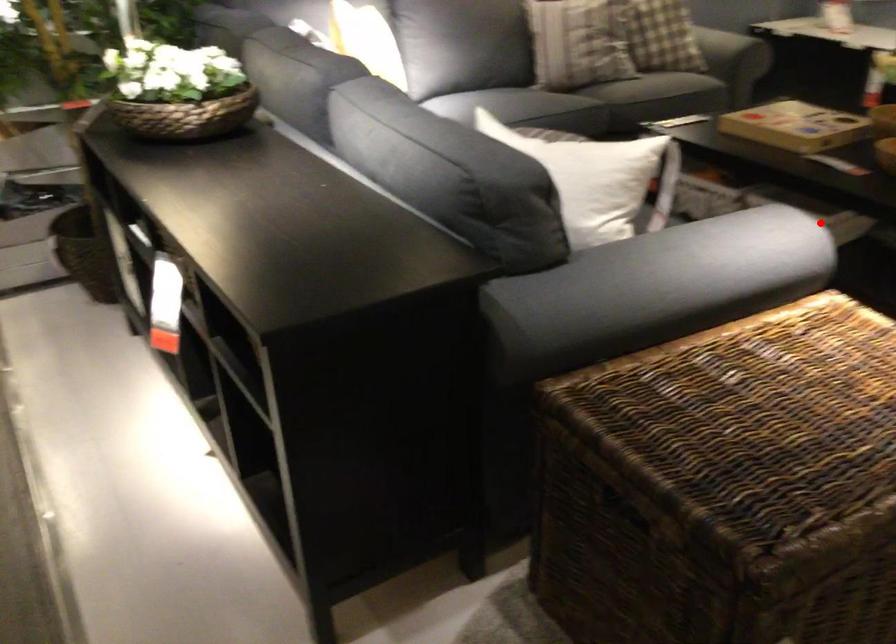
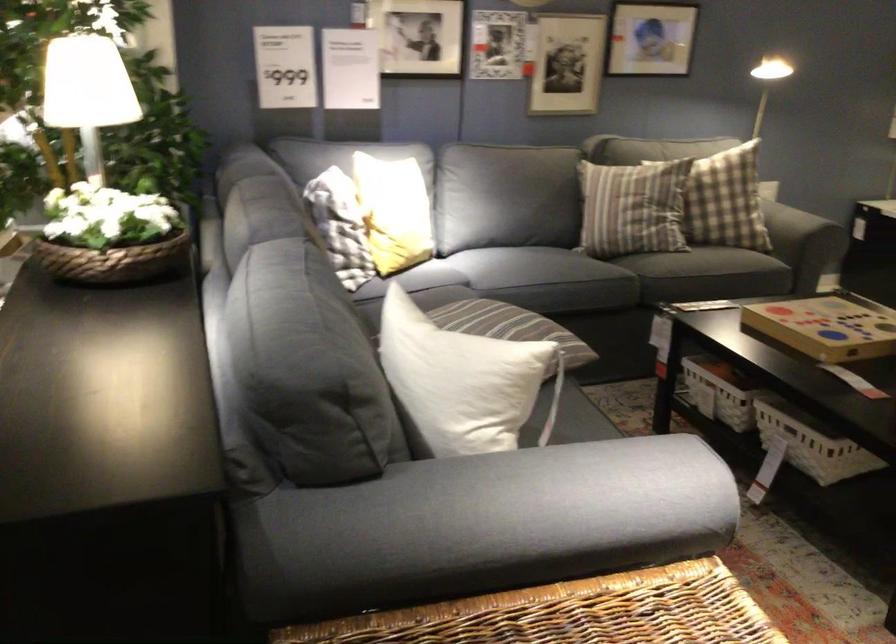
The point at the highlighted location is marked in the first image. Where is the corresponding point in the second image?

(814, 448)